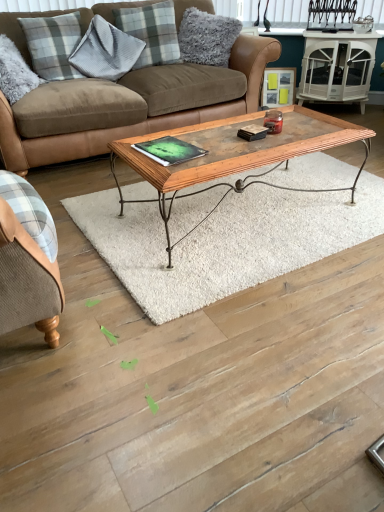
Identify the location of vacant area on top of green matte book at center (from a real-world perspective). (174, 143).